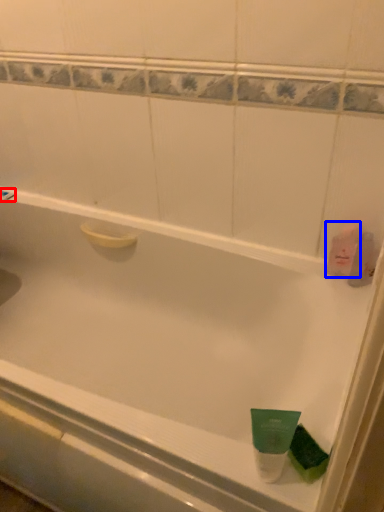
Question: Which object is further to the camera taking this photo, shower (highlighted by a red box) or mouthwash (highlighted by a blue box)?

Choices:
 (A) shower
 (B) mouthwash

Answer: (A)